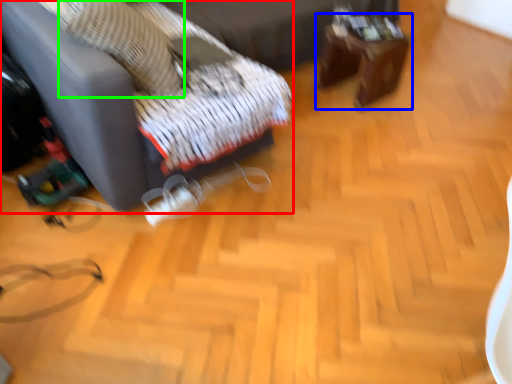
Question: Based on their relative distances, which object is nearer to furniture (highlighted by a red box)? Choose from table (highlighted by a blue box) and pillow (highlighted by a green box).

Choices:
 (A) table
 (B) pillow

Answer: (B)